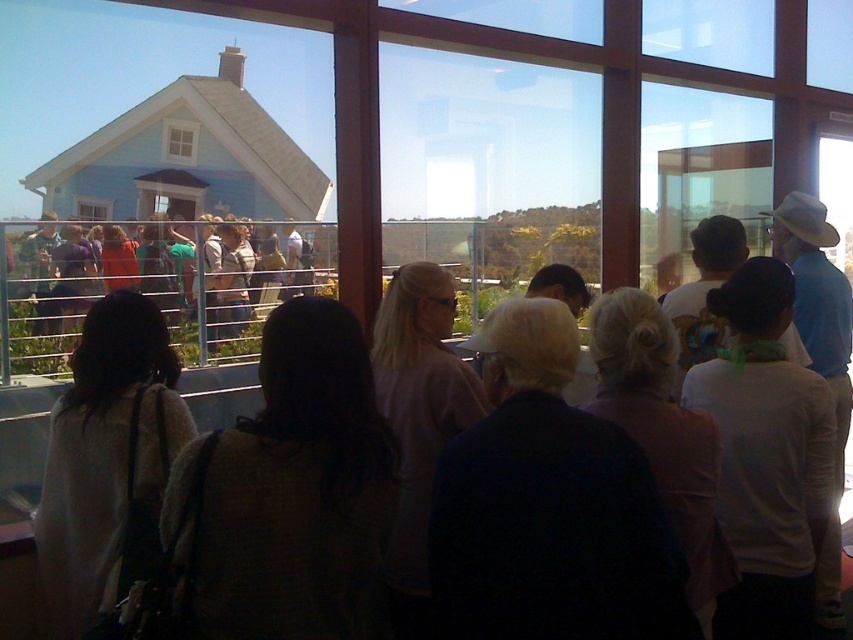
Who is more distant from viewer, (86,340) or (848,570)?

The point (848,570) is behind.

Between point (187, 424) and point (548, 292), which one is positioned behind?

The point (548, 292) is behind.

At what (x,y) coordinates should I click in order to perform the action: click on light beige sweater at left. Please return your answer as a coordinate pair (x, y). The image size is (853, 640). Looking at the image, I should click on (108, 461).

Is white wooden window at upper center shorter than transparent glass window at upper left?

No.

Can you confirm if white wooden window at upper center is positioned to the right of transparent glass window at upper left?

Yes, white wooden window at upper center is to the right of transparent glass window at upper left.

The height and width of the screenshot is (640, 853). What do you see at coordinates (180, 141) in the screenshot? I see `white wooden window at upper center` at bounding box center [180, 141].

Identify the location of white wooden window at upper center. This screenshot has width=853, height=640. (180, 141).

Who is more forward, (28,419) or (76,209)?

Point (28,419) is more forward.

Does point (828, 280) lie in front of point (102, 202)?

Yes, it is in front of point (102, 202).

Locate an element on the screen. The height and width of the screenshot is (640, 853). light brown sweater at center is located at coordinates (706, 269).

Image resolution: width=853 pixels, height=640 pixels. Find the location of `light brown sweater at center`. light brown sweater at center is located at coordinates (706, 269).